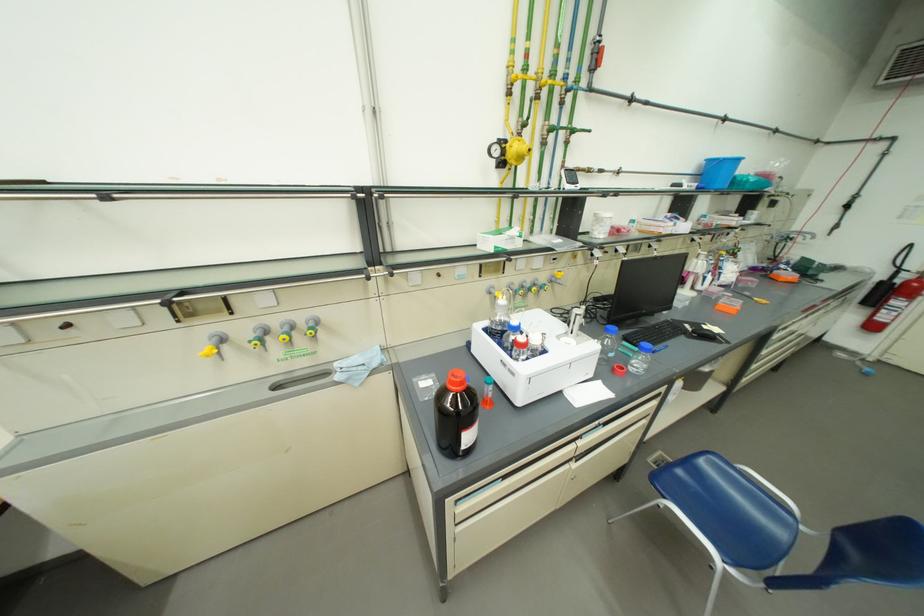
What do you see at coordinates (727, 509) in the screenshot?
I see `the blue chair sitting surface` at bounding box center [727, 509].